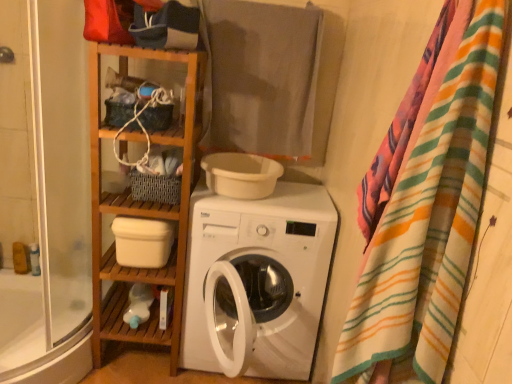
Question: From a real-world perspective, relative to transparent glass shower door at left, is woven fabric basket at center, the 2th shelf ordered from the bottom, vertically above or below?

Choices:
 (A) above
 (B) below

Answer: (A)

Question: Is woven fabric basket at center, which ranks as the first shelf in top-to-bottom order, situated inside transparent glass shower door at left or outside?

Choices:
 (A) inside
 (B) outside

Answer: (B)

Question: Which is farther from the white matte washing machine at center?

Choices:
 (A) white matte bowl at center
 (B) gray cotton towel at upper center
 (C) woven fabric basket at center, which ranks as the first shelf in top-to-bottom order
 (D) wooden shelf at upper left, the second cabinet from the bottom
 (E) white matte plastic container at center-left, the 1th shelf ordered from the bottom

Answer: (D)

Question: Estimate the real-world distances between objects in this image. Which object is closer to the white matte plastic container at center-left, the 1th shelf ordered from the bottom?

Choices:
 (A) striped cotton blanket at right
 (B) white matte washing machine at center
 (C) wooden shelf at upper left, which is the 1th cabinet in top-to-bottom order
 (D) gray cotton towel at upper center
 (E) white glossy bathtub at lower left

Answer: (B)